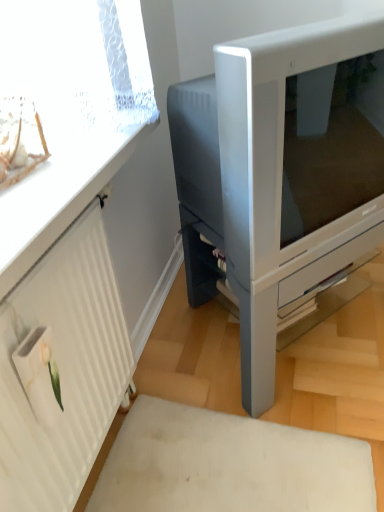
The image size is (384, 512). In order to click on vacant space in white textured radiator at left (from a real-world perspective) in this screenshot , I will do `click(115, 440)`.